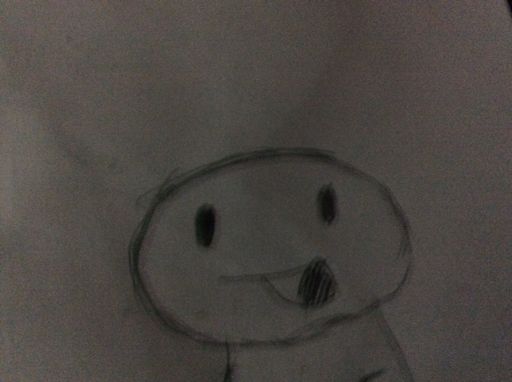
Locate an element on the screen. This screenshot has width=512, height=382. small dark brown triangular corner is located at coordinates (507, 3).